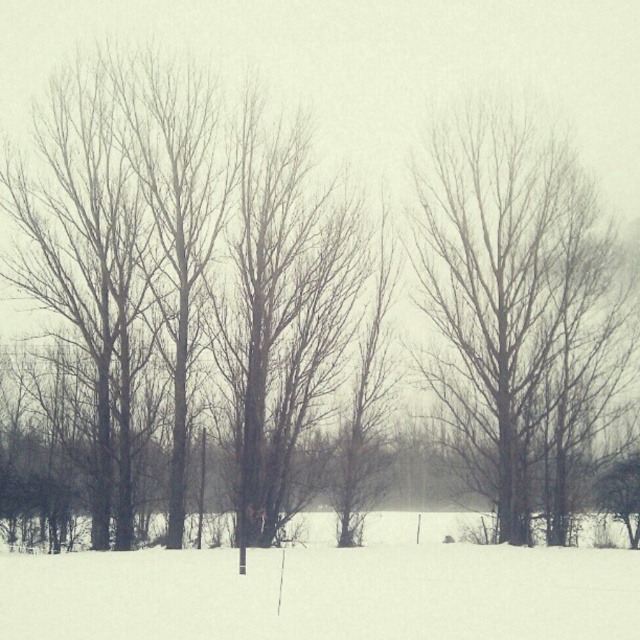
You are standing in the winter landscape and want to walk towards the white powdery snow at lower center. Which direction should you move relative to the bare wood tree at right?

The white powdery snow at lower center is behind the bare wood tree at right, so you should move away from the bare wood tree at right to reach the white powdery snow at lower center.

You are an observer standing in the winter landscape. You notice the bare wood tree at right and the white powdery snow at lower center. Which object appears taller from your viewpoint?

The bare wood tree at right is taller than the white powdery snow at lower center.